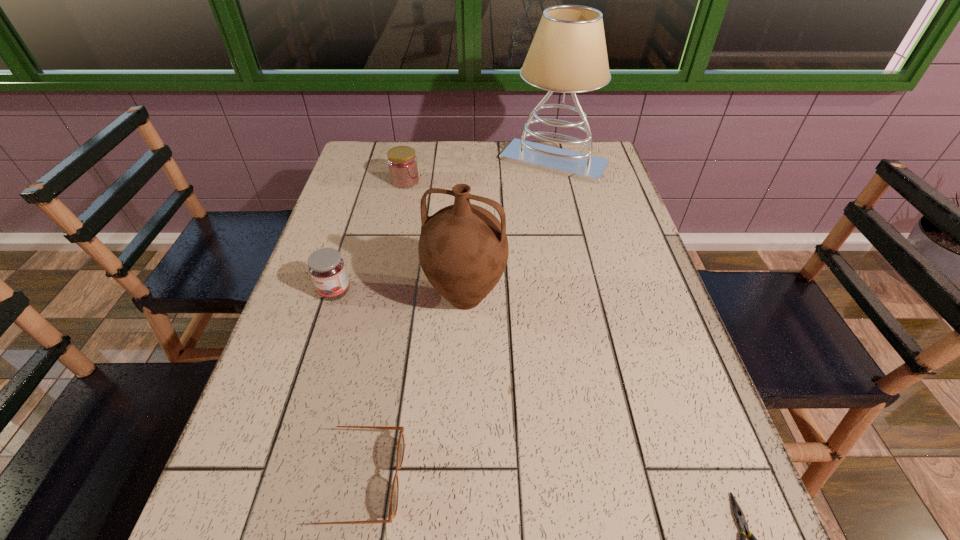
Where is `table lamp`? table lamp is located at coordinates (568, 54).

Find the location of a particular element. pitcher is located at coordinates (463, 249).

At what (x,y) coordinates should I click in order to perform the action: click on the fifth shortest object. Please return your answer as a coordinate pair (x, y). Looking at the image, I should click on (463, 249).

The width and height of the screenshot is (960, 540). Identify the location of the left jam. (326, 266).

At what (x,y) coordinates should I click in order to perform the action: click on the nearer jam. Please return your answer as a coordinate pair (x, y). The height and width of the screenshot is (540, 960). Looking at the image, I should click on (326, 266).

Image resolution: width=960 pixels, height=540 pixels. I want to click on the farther jam, so click(402, 163).

Identify the location of the second shortest object. This screenshot has height=540, width=960. (393, 506).

The image size is (960, 540). Identify the location of free location located on the front of the tallest object. (575, 257).

The image size is (960, 540). In order to click on vacant region located on the back of the third object from right to left in this screenshot , I will do `click(468, 221)`.

Where is `vacant region located 0.170m on the front of the nearer jam`? This screenshot has width=960, height=540. vacant region located 0.170m on the front of the nearer jam is located at coordinates (311, 366).